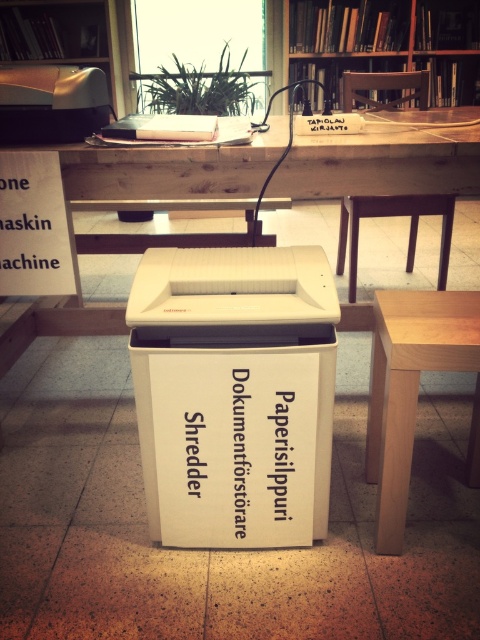
You are standing at the entrance of the library and see the point marked at coordinates [385,160]. Which object is this point located on?

The point marked at coordinates [385,160] is located on the white plastic table at center.

You are organizing a space and need to place a large printer that requires a bigger surface. Which table should you choose between the white plastic table at center and the light brown wooden table at center?

The white plastic table at center is bigger than the light brown wooden table at center, so you should choose the white plastic table at center for placing the large printer.

You are standing at the entrance of the library and want to reach the light brown wooden table at center. According to the coordinates provided, in which direction should you move relative to your current position?

The light brown wooden table at center is located at coordinates point (414,388). Since the coordinate system typically places (0,0) at the bottom left corner, moving towards higher x and y values would mean moving to the right and upwards. Therefore, you should move to the right and upwards from your current position to reach the light brown wooden table at center.